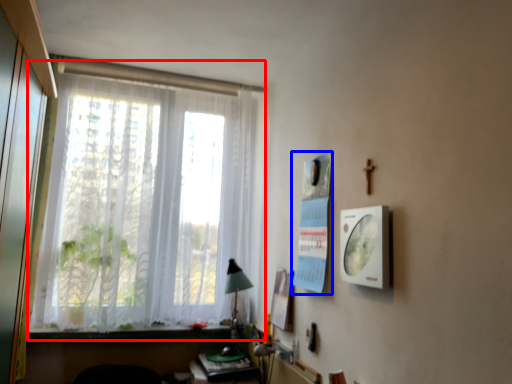
Question: Which point is further to the camera, window (highlighted by a red box) or poster page (highlighted by a blue box)?

Choices:
 (A) window
 (B) poster page

Answer: (A)